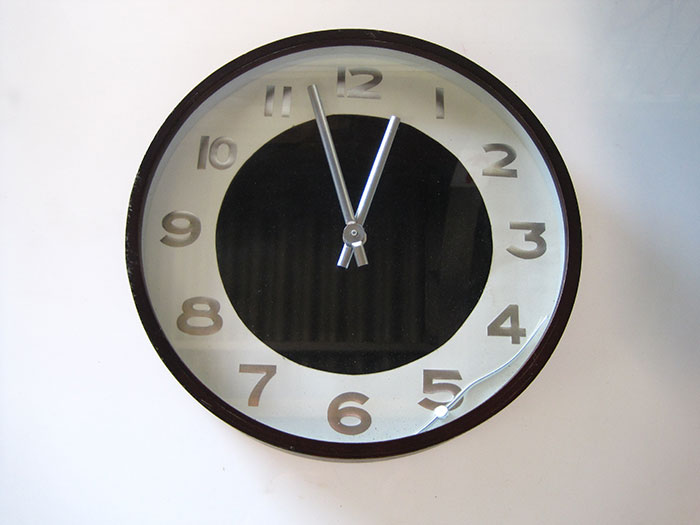
The width and height of the screenshot is (700, 525). I want to click on shadows on white wall, so click(x=666, y=205).